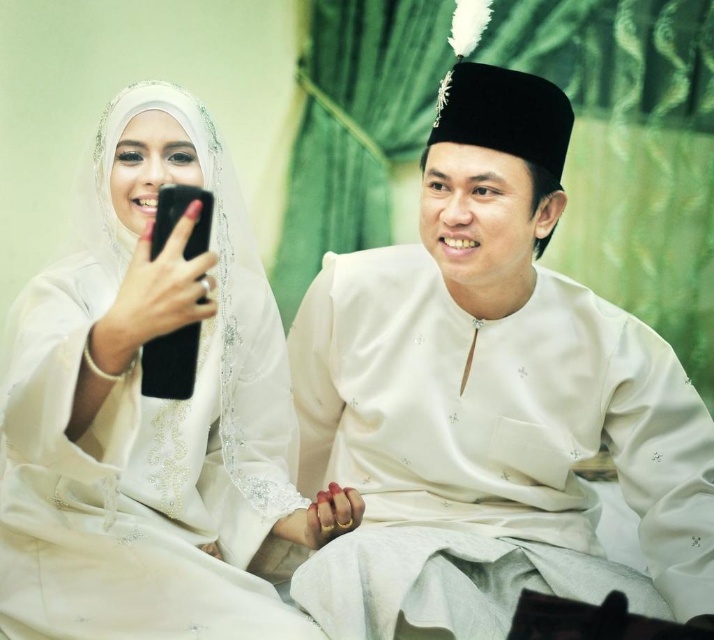
Question: Among these objects, which one is nearest to the camera?

Choices:
 (A) white sheer dress at left
 (B) white satin khat at center

Answer: (A)

Question: Which point appears closest to the camera in this image?

Choices:
 (A) (663, 420)
 (B) (26, 554)

Answer: (B)

Question: Is white satin khat at center positioned before white sheer dress at left?

Choices:
 (A) yes
 (B) no

Answer: (B)

Question: Is white satin khat at center wider than white sheer dress at left?

Choices:
 (A) yes
 (B) no

Answer: (A)

Question: Which point is farther from the camera taking this photo?

Choices:
 (A) (31, 540)
 (B) (373, 522)

Answer: (B)

Question: Is white satin khat at center to the left of white sheer dress at left from the viewer's perspective?

Choices:
 (A) no
 (B) yes

Answer: (A)